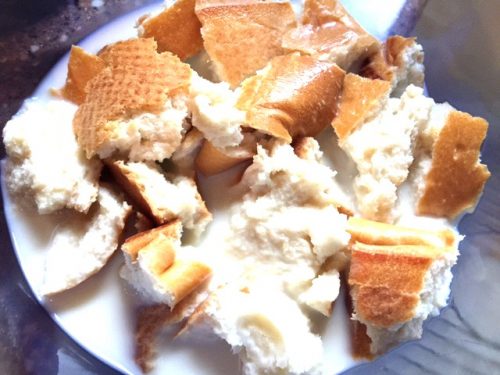
Image resolution: width=500 pixels, height=375 pixels. Identify the location of plate. (105, 328).